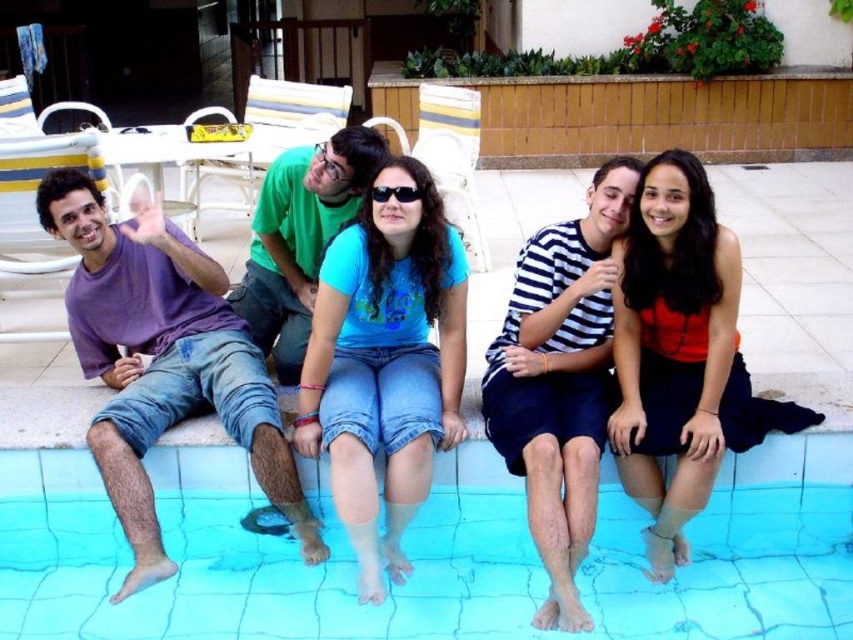
You are a photographer trying to capture a group photo of the blue matte shirt at center and the striped cotton shirt at center. The camera you are using has a minimum focus distance of 20 inches. Will you be able to focus on both subjects clearly without moving the camera or subjects?

The distance between the blue matte shirt at center and the striped cotton shirt at center is 19.38 inches, which is less than the camera minimum focus distance of 20 inches. Therefore, the camera cannot focus on both subjects clearly without adjusting the distance between them or using a different camera setting.